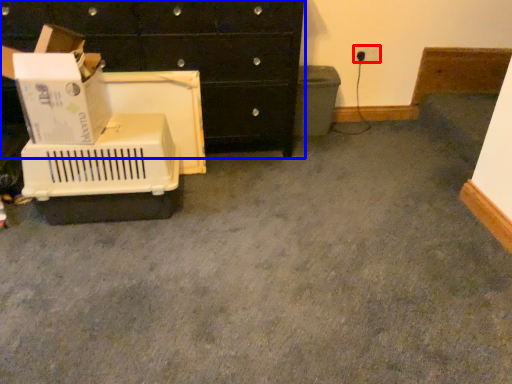
Question: Among these objects, which one is nearest to the camera, electric outlet (highlighted by a red box) or chest of drawers (highlighted by a blue box)?

Choices:
 (A) electric outlet
 (B) chest of drawers

Answer: (B)